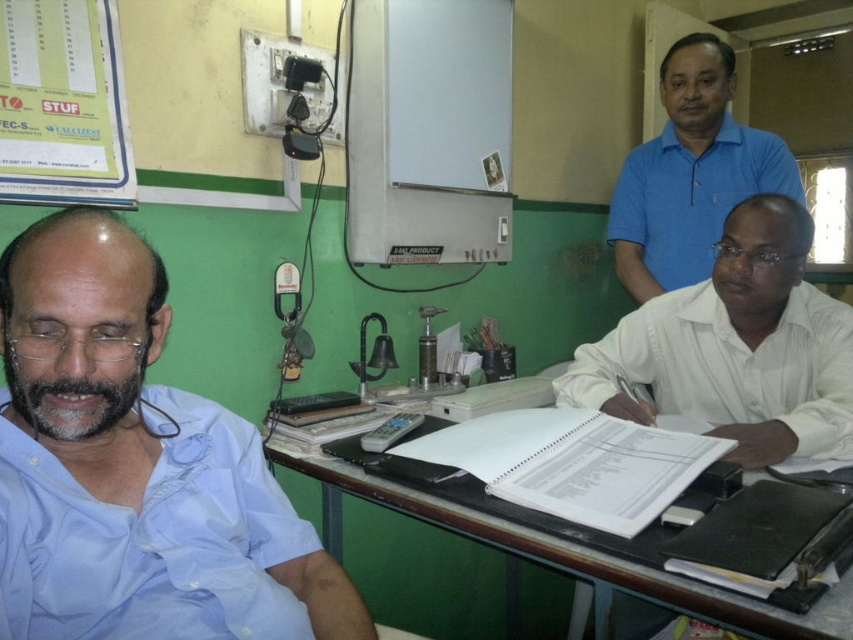
Is white paper at center taller than white paper at upper left?

Correct, white paper at center is much taller as white paper at upper left.

How far apart are white paper at center and white paper at upper left?

The distance of white paper at center from white paper at upper left is 3.52 feet.

What do you see at coordinates (735, 348) in the screenshot? I see `white paper at center` at bounding box center [735, 348].

This screenshot has width=853, height=640. I want to click on white paper at center, so click(x=735, y=348).

Does blue polo shirt at upper center appear over brown wooden table at center?

Correct, blue polo shirt at upper center is located above brown wooden table at center.

Does blue polo shirt at upper center appear on the left side of brown wooden table at center?

Incorrect, blue polo shirt at upper center is not on the left side of brown wooden table at center.

What do you see at coordinates (689, 173) in the screenshot? I see `blue polo shirt at upper center` at bounding box center [689, 173].

I want to click on blue polo shirt at upper center, so click(x=689, y=173).

Who is more distant from viewer, (x=672, y=77) or (x=86, y=6)?

Positioned behind is point (x=672, y=77).

Which is more to the left, blue polo shirt at upper center or white paper at upper left?

white paper at upper left is more to the left.

Is point (755, 129) closer to camera compared to point (10, 93)?

No, (755, 129) is further to viewer.

Locate an element on the screen. The image size is (853, 640). blue polo shirt at upper center is located at coordinates (689, 173).